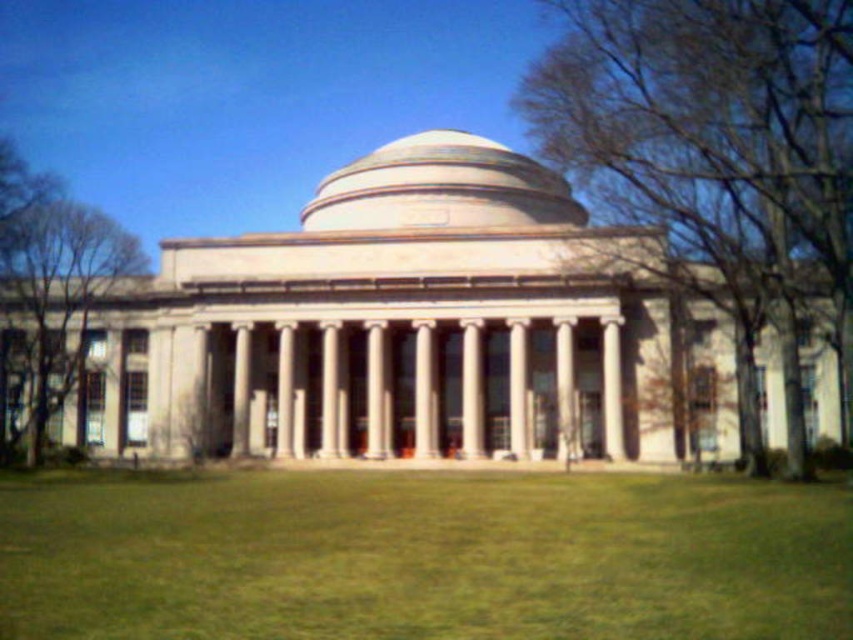
Question: Does white marble column at center come behind white marble pillar at center?

Choices:
 (A) yes
 (B) no

Answer: (B)

Question: Is green grass at center bigger than bare branches at right?

Choices:
 (A) yes
 (B) no

Answer: (B)

Question: Which object appears closest to the camera in this image?

Choices:
 (A) green leafy tree at left
 (B) beige stone dome at center

Answer: (A)

Question: Which point appears farthest from the camera in this image?

Choices:
 (A) (662, 572)
 (B) (552, 48)
 (C) (242, 406)
 (D) (398, 192)

Answer: (B)

Question: Can you confirm if green leafy tree at left is bigger than white marble pillar at center?

Choices:
 (A) yes
 (B) no

Answer: (A)

Question: Estimate the real-world distances between objects in this image. Which object is farther from the green leafy tree at left?

Choices:
 (A) green grass at center
 (B) white marble column at center
 (C) bare branches at right
 (D) white marble pillar at center

Answer: (C)